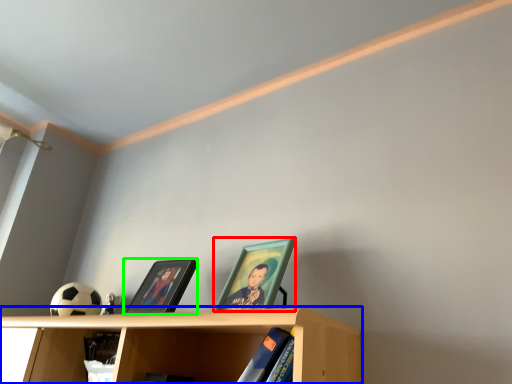
Question: Which is farther away from picture frame (highlighted by a red box)? shelf (highlighted by a blue box) or picture frame (highlighted by a green box)?

Choices:
 (A) shelf
 (B) picture frame

Answer: (B)